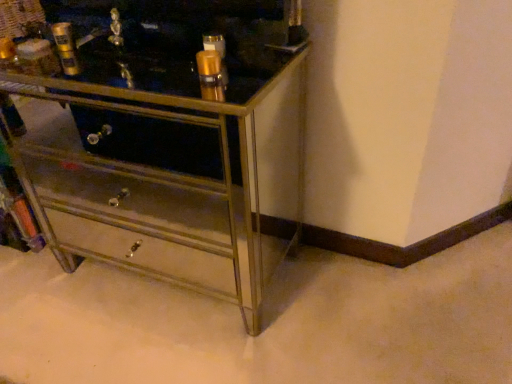
At what (x,y) coordinates should I click in order to perform the action: click on spots to the right of metallic mirrored chest of drawers at center. Please return your answer as a coordinate pair (x, y). This screenshot has width=512, height=384. Looking at the image, I should click on (372, 308).